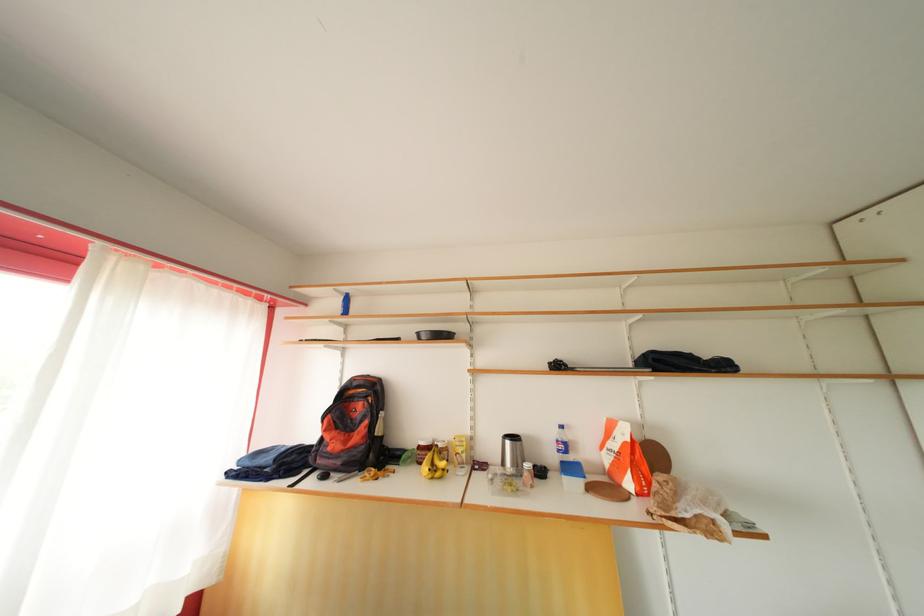
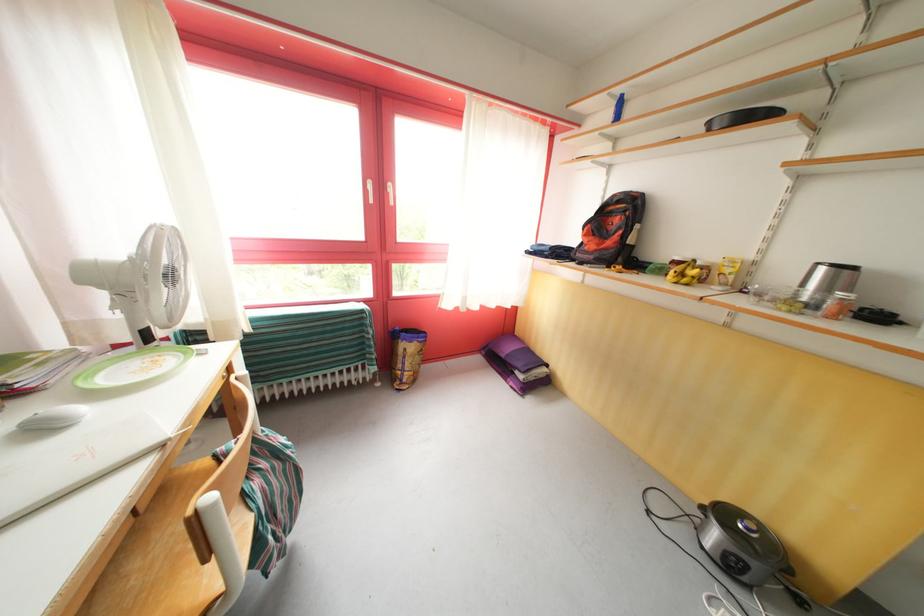
Locate, in the second image, the point that corresponds to point (346, 294) in the first image.

(621, 95)